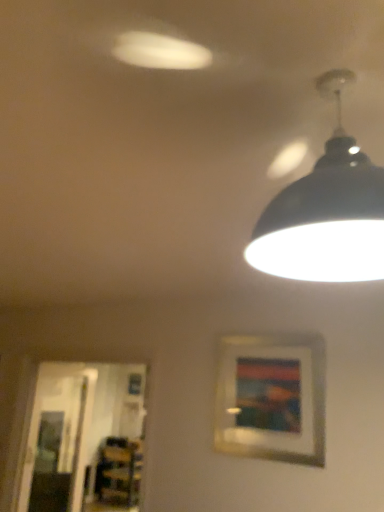
Image resolution: width=384 pixels, height=512 pixels. Describe the element at coordinates (57, 440) in the screenshot. I see `transparent glass door at left, the second glass door in the front-to-back sequence` at that location.

Image resolution: width=384 pixels, height=512 pixels. What do you see at coordinates (272, 397) in the screenshot?
I see `wooden picture frame at center` at bounding box center [272, 397].

This screenshot has height=512, width=384. In order to click on black matte lampshade at upper right in this screenshot , I will do `click(326, 213)`.

Where is `furniture to the right of transparent glass door at left, arranged as the 2th glass door when viewed from the right`? The image size is (384, 512). furniture to the right of transparent glass door at left, arranged as the 2th glass door when viewed from the right is located at coordinates (119, 472).

Based on their positions, is transparent glass door at left, arranged as the 2th glass door when viewed from the right, located to the left or right of wooden bookshelf at lower left?

Based on their positions, transparent glass door at left, arranged as the 2th glass door when viewed from the right, is located to the left of wooden bookshelf at lower left.

From the image's perspective, is transparent glass door at left, arranged as the 2th glass door when viewed from the right, located above or below wooden bookshelf at lower left?

transparent glass door at left, arranged as the 2th glass door when viewed from the right, is above wooden bookshelf at lower left.

From the image's perspective, which is above, transparent glass door at left, which appears as the 1th glass door when viewed from the back, or transparent glass door at lower left, placed as the 1th glass door when sorted from front to back?

transparent glass door at lower left, placed as the 1th glass door when sorted from front to back, from the image's perspective.

Is transparent glass door at left, acting as the 1th glass door starting from the left, located outside transparent glass door at lower left, placed as the 1th glass door when sorted from front to back?

transparent glass door at left, acting as the 1th glass door starting from the left, lies outside transparent glass door at lower left, placed as the 1th glass door when sorted from front to back,'s area.

Based on the photo, how much distance is there between transparent glass door at left, which appears as the 1th glass door when viewed from the back, and transparent glass door at lower left, the 2th glass door in the left-to-right sequence?

transparent glass door at left, which appears as the 1th glass door when viewed from the back, and transparent glass door at lower left, the 2th glass door in the left-to-right sequence, are 6.94 inches apart from each other.

Considering the sizes of objects transparent glass door at left, which appears as the 1th glass door when viewed from the back, and transparent glass door at lower left, placed as the 1th glass door when sorted from front to back, in the image provided, who is shorter, transparent glass door at left, which appears as the 1th glass door when viewed from the back, or transparent glass door at lower left, placed as the 1th glass door when sorted from front to back,?

With less height is transparent glass door at left, which appears as the 1th glass door when viewed from the back.

From a real-world perspective, relative to black matte lampshade at upper right, is wooden picture frame at center vertically above or below?

In terms of real-world spatial position, wooden picture frame at center is below black matte lampshade at upper right.

Does wooden picture frame at center come behind black matte lampshade at upper right?

Yes, it is behind black matte lampshade at upper right.

Which is in front, point (238, 349) or point (350, 214)?

The point (350, 214) is closer.

From the image's perspective, is wooden picture frame at center located beneath black matte lampshade at upper right?

Indeed, from the image's perspective, wooden picture frame at center is shown beneath black matte lampshade at upper right.

Consider the image. Measure the distance from black matte lampshade at upper right to transparent glass door at lower left, which is the second glass door in back-to-front order.

black matte lampshade at upper right is 6.09 meters away from transparent glass door at lower left, which is the second glass door in back-to-front order.

Is transparent glass door at lower left, the 2th glass door in the left-to-right sequence, surrounded by black matte lampshade at upper right?

Definitely not — transparent glass door at lower left, the 2th glass door in the left-to-right sequence, is not inside black matte lampshade at upper right.

Is black matte lampshade at upper right positioned far away from transparent glass door at lower left, the 2th glass door in the left-to-right sequence?

Yes, black matte lampshade at upper right is far from transparent glass door at lower left, the 2th glass door in the left-to-right sequence.

Does point (345, 233) lie in front of point (71, 459)?

Yes, it is in front of point (71, 459).

Based on their positions, is wooden bookshelf at lower left located to the left or right of wooden picture frame at center?

In the image, wooden bookshelf at lower left appears on the left side of wooden picture frame at center.

Is wooden bookshelf at lower left next to wooden picture frame at center?

No, wooden bookshelf at lower left is not in contact with wooden picture frame at center.

Which is in front, point (127, 502) or point (244, 354)?

The point (244, 354) is more forward.

From a real-world perspective, between wooden bookshelf at lower left and wooden picture frame at center, who is vertically lower?

wooden bookshelf at lower left is physically lower.

Is black matte lampshade at upper right facing away from wooden picture frame at center?

No, black matte lampshade at upper right is not facing away from wooden picture frame at center.

Considering the positions of objects black matte lampshade at upper right and wooden picture frame at center in the image provided, who is behind, black matte lampshade at upper right or wooden picture frame at center?

wooden picture frame at center.

Looking at this image, does black matte lampshade at upper right have a smaller size compared to wooden picture frame at center?

No, black matte lampshade at upper right is not smaller than wooden picture frame at center.

Can we say black matte lampshade at upper right lies outside wooden picture frame at center?

Yes.

Considering the relative sizes of transparent glass door at lower left, the 2th glass door in the left-to-right sequence, and wooden picture frame at center in the image provided, is transparent glass door at lower left, the 2th glass door in the left-to-right sequence, wider than wooden picture frame at center?

Yes, transparent glass door at lower left, the 2th glass door in the left-to-right sequence, is wider than wooden picture frame at center.

From the image's perspective, who appears lower, transparent glass door at lower left, arranged as the 1th glass door when viewed from the right, or wooden picture frame at center?

transparent glass door at lower left, arranged as the 1th glass door when viewed from the right.

Which is more to the left, transparent glass door at lower left, arranged as the 1th glass door when viewed from the right, or wooden picture frame at center?

From the viewer's perspective, transparent glass door at lower left, arranged as the 1th glass door when viewed from the right, appears more on the left side.

Where is `glass door that is the 1st object located below the wooden picture frame at center (from the image's perspective)`? This screenshot has height=512, width=384. glass door that is the 1st object located below the wooden picture frame at center (from the image's perspective) is located at coordinates (84, 438).

The width and height of the screenshot is (384, 512). I want to click on furniture on the right of transparent glass door at left, which appears as the 1th glass door when viewed from the back, so click(119, 472).

I want to click on glass door located above the transparent glass door at left, which appears as the 1th glass door when viewed from the back (from the image's perspective), so pos(84,438).

When comparing their distances from transparent glass door at lower left, the 2th glass door in the left-to-right sequence, does wooden picture frame at center or wooden bookshelf at lower left seem further?

wooden picture frame at center is positioned further to the anchor transparent glass door at lower left, the 2th glass door in the left-to-right sequence.

Based on their spatial positions, is transparent glass door at lower left, which is the second glass door in back-to-front order, or black matte lampshade at upper right closer to transparent glass door at left, which appears as the 1th glass door when viewed from the back?

The object closer to transparent glass door at left, which appears as the 1th glass door when viewed from the back, is transparent glass door at lower left, which is the second glass door in back-to-front order.

Looking at the image, which one is located further to wooden picture frame at center, wooden bookshelf at lower left or black matte lampshade at upper right?

wooden bookshelf at lower left is positioned further to the anchor wooden picture frame at center.

Considering their positions, is transparent glass door at lower left, which is the second glass door in back-to-front order, positioned further to wooden picture frame at center than black matte lampshade at upper right?

transparent glass door at lower left, which is the second glass door in back-to-front order.

Looking at the image, which one is located closer to wooden picture frame at center, black matte lampshade at upper right or transparent glass door at left, acting as the 1th glass door starting from the left?

black matte lampshade at upper right is positioned closer to the anchor wooden picture frame at center.

When comparing their distances from transparent glass door at left, arranged as the 2th glass door when viewed from the right, does black matte lampshade at upper right or wooden bookshelf at lower left seem further?

black matte lampshade at upper right.

From the image, which object appears to be farther from transparent glass door at lower left, placed as the 1th glass door when sorted from front to back, wooden bookshelf at lower left or wooden picture frame at center?

wooden picture frame at center is further to transparent glass door at lower left, placed as the 1th glass door when sorted from front to back.

Based on their spatial positions, is transparent glass door at left, which appears as the 1th glass door when viewed from the back, or wooden bookshelf at lower left closer to wooden picture frame at center?

Based on the image, wooden bookshelf at lower left appears to be nearer to wooden picture frame at center.

The width and height of the screenshot is (384, 512). I want to click on glass door positioned between wooden picture frame at center and transparent glass door at left, acting as the 1th glass door starting from the left, from near to far, so click(x=84, y=438).

Where is `glass door between black matte lampshade at upper right and transparent glass door at left, acting as the 1th glass door starting from the left, in the front-back direction`? glass door between black matte lampshade at upper right and transparent glass door at left, acting as the 1th glass door starting from the left, in the front-back direction is located at coordinates [84, 438].

Where is `picture frame between black matte lampshade at upper right and transparent glass door at left, the second glass door in the front-to-back sequence, along the z-axis`? The image size is (384, 512). picture frame between black matte lampshade at upper right and transparent glass door at left, the second glass door in the front-to-back sequence, along the z-axis is located at coordinates [x=272, y=397].

In order to click on glass door positioned between transparent glass door at lower left, the 2th glass door in the left-to-right sequence, and wooden bookshelf at lower left from near to far in this screenshot , I will do `click(57, 440)`.